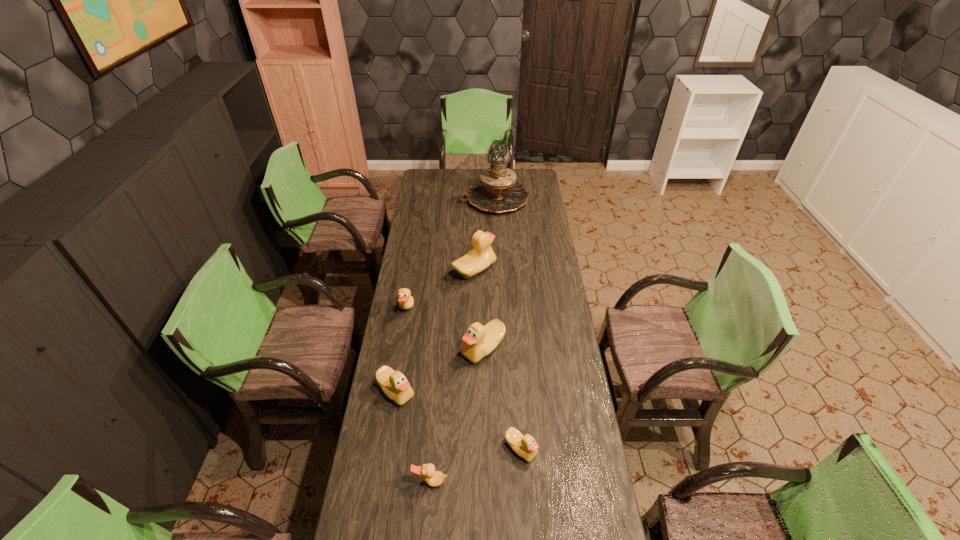
Locate an element on the screen. The image size is (960, 540). free region located on the beak of the bigger tan duck is located at coordinates (464, 310).

What are the coordinates of `free space located at the beak of the nearest beige duck` in the screenshot? It's located at (526, 521).

Locate an element on the screen. vacant region located 0.140m on the beak of the nearest object is located at coordinates (426, 539).

Identify the location of object that is at the far edge. (497, 192).

This screenshot has height=540, width=960. In order to click on object located in the right edge section of the desktop in this screenshot , I will do `click(497, 192)`.

Identify the location of object that is positioned at the far right corner. (497, 192).

Identify the location of vacant region at the far edge of the desktop. (458, 178).

Identify the location of free space at the left edge of the desktop. (420, 239).

The image size is (960, 540). Identify the location of vacant space at the right edge of the desktop. (531, 265).

Where is `vacant space at the far left corner`? This screenshot has width=960, height=540. vacant space at the far left corner is located at coordinates (427, 182).